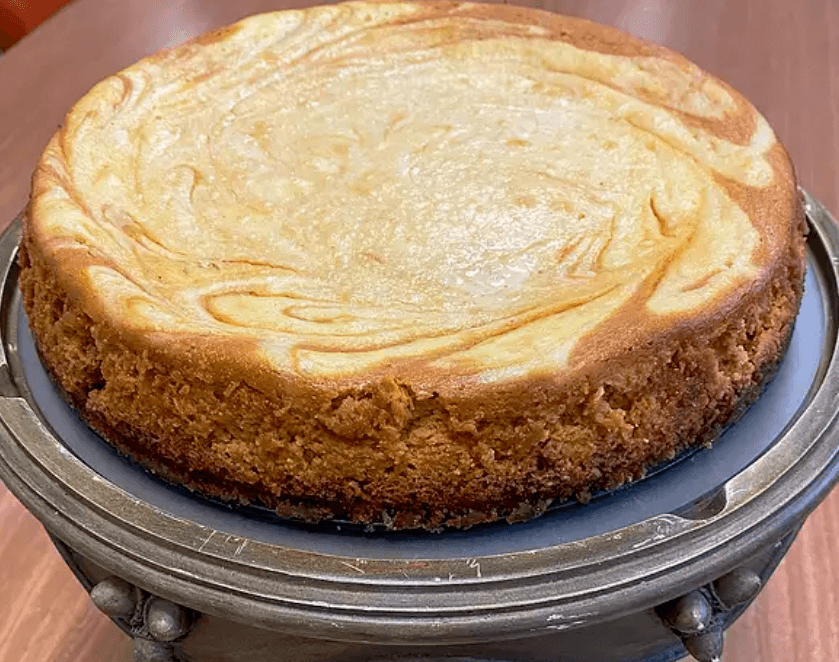
The width and height of the screenshot is (839, 662). I want to click on cake tray, so click(x=778, y=395).